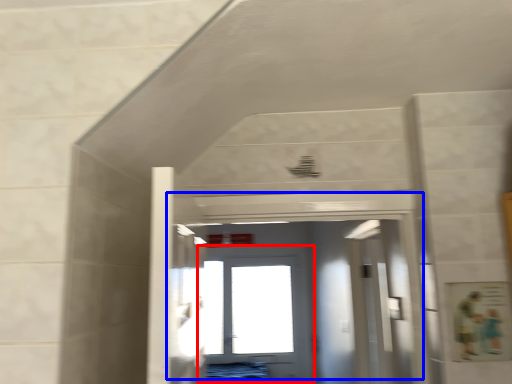
Question: Which object is closer to the camera taking this photo, door (highlighted by a red box) or door (highlighted by a blue box)?

Choices:
 (A) door
 (B) door

Answer: (B)